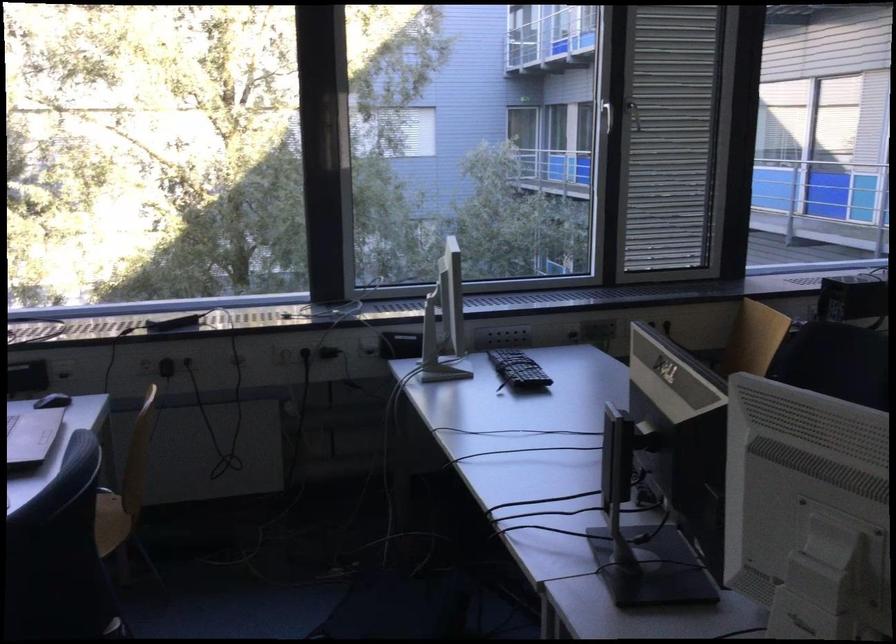
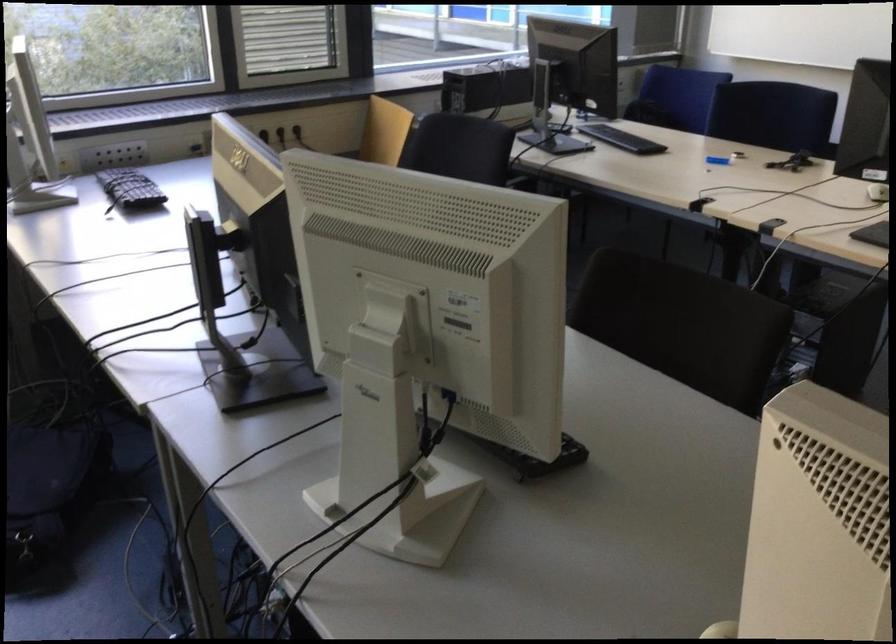
Question: In a continuous first-person perspective shot, in which direction is the camera moving?

Choices:
 (A) Left
 (B) Right
 (C) Forward
 (D) Backward

Answer: (B)